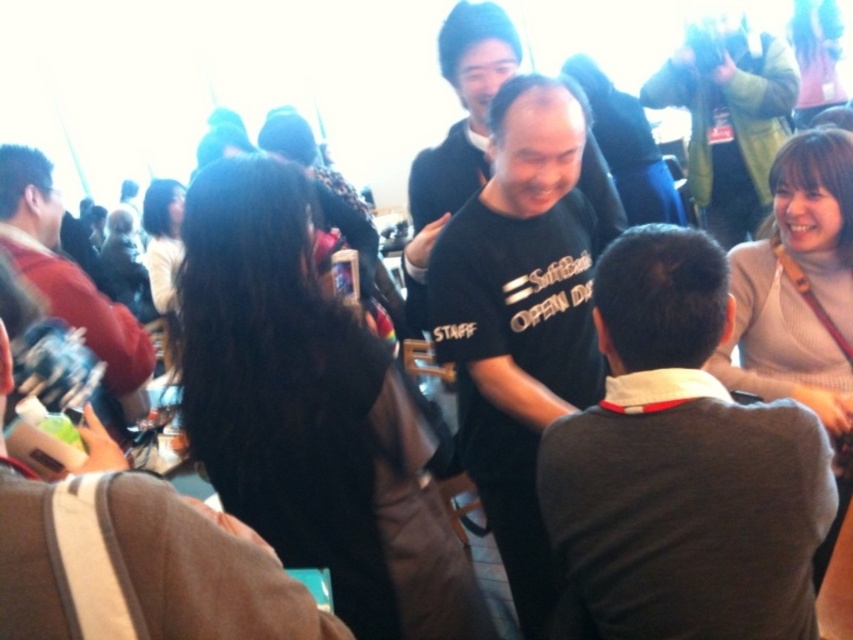
You are at the event and want to move from the point at coordinates point (x=48, y=248) to the point at coordinates point (x=517, y=522). According to the image, which direction should you move to get closer to your destination?

Since point (x=517, y=522) is in front of point (x=48, y=248), you should move forward to reach your destination.

You are attending an event and see two people wearing black shirts. One is wearing a black matte shirt at center and the other a matte black shirt at left. Which person is positioned more to the right?

The black matte shirt at center is positioned more to the right compared to the matte black shirt at left.

You are a photographer at the event and need to capture a group photo of the dark gray shirt at center and the black matte shirt at center. Which person should you position closer to the camera to ensure both are in focus?

The dark gray shirt at center is shorter than the black matte shirt at center, so you should position the dark gray shirt at center closer to the camera to ensure both are in focus.